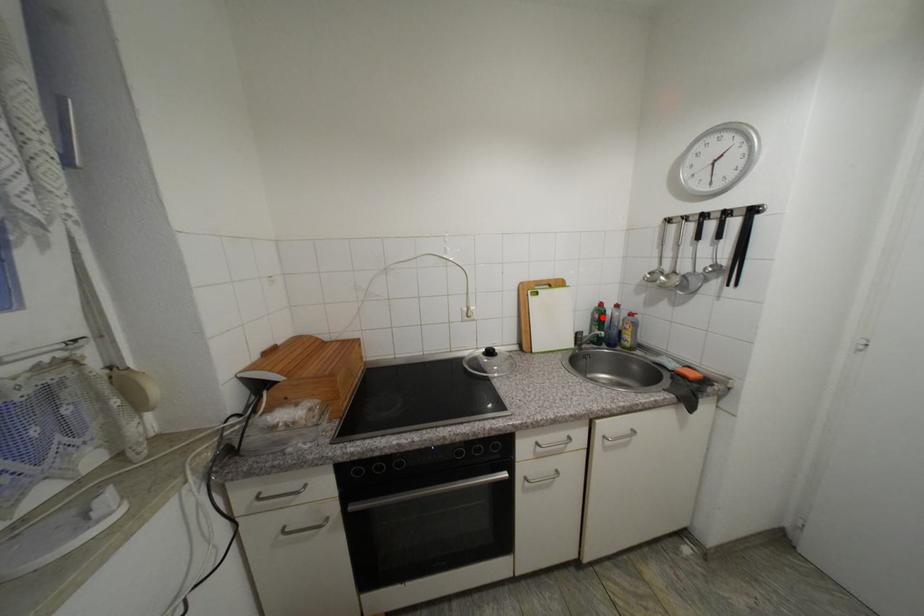
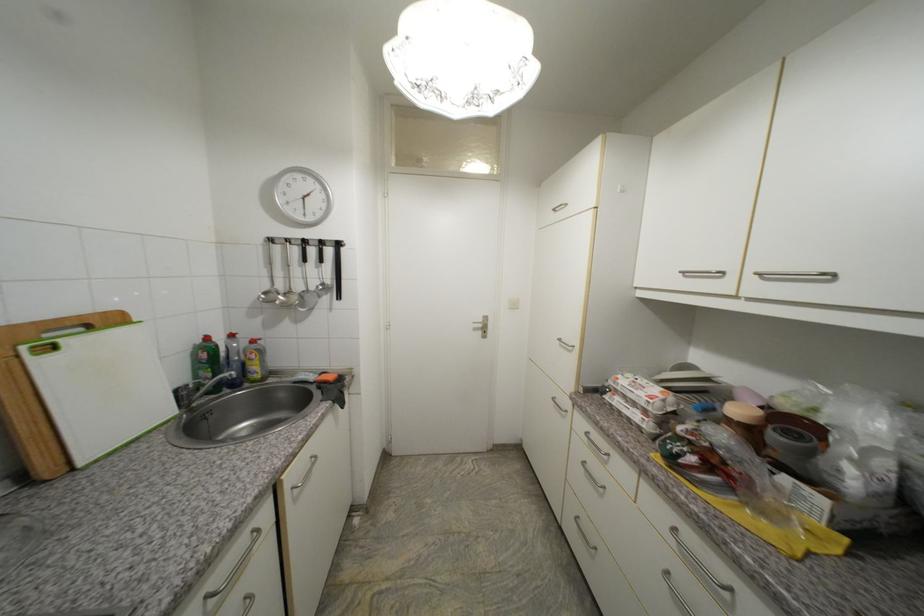
The point at the highlighted location is marked in the first image. Where is the corresponding point in the second image?

(210, 357)